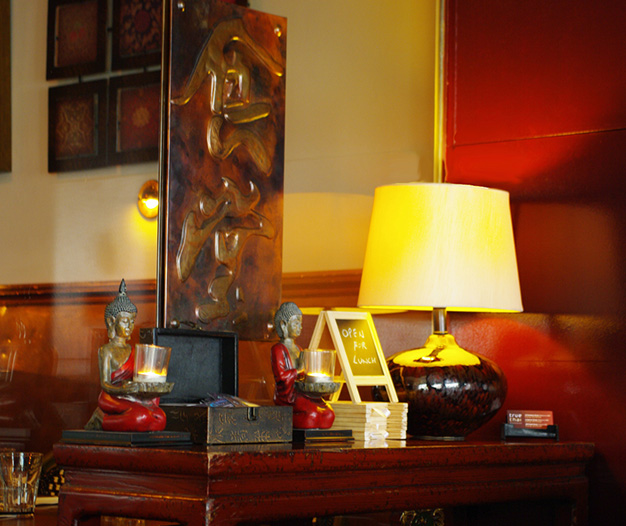
Where is `desk`? desk is located at coordinates (389, 478).